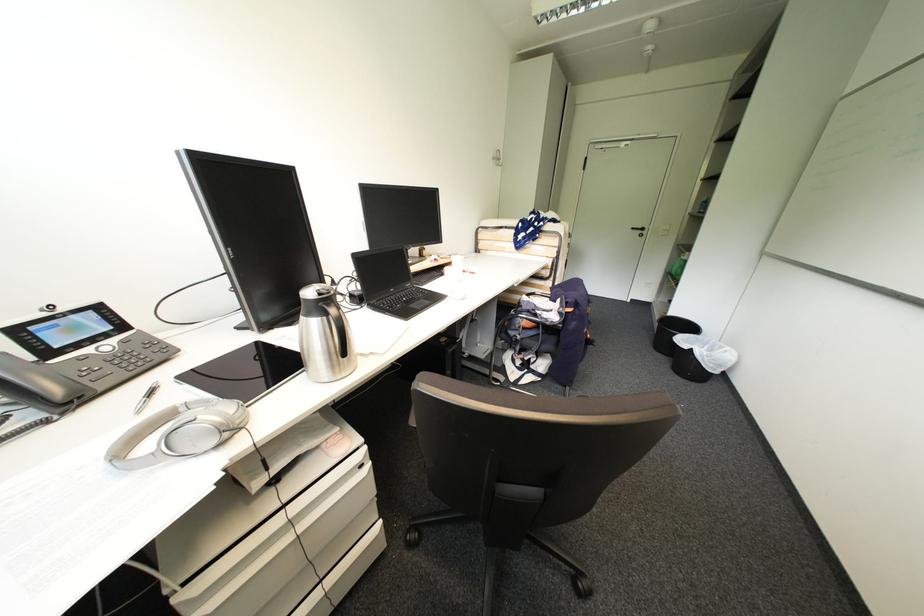
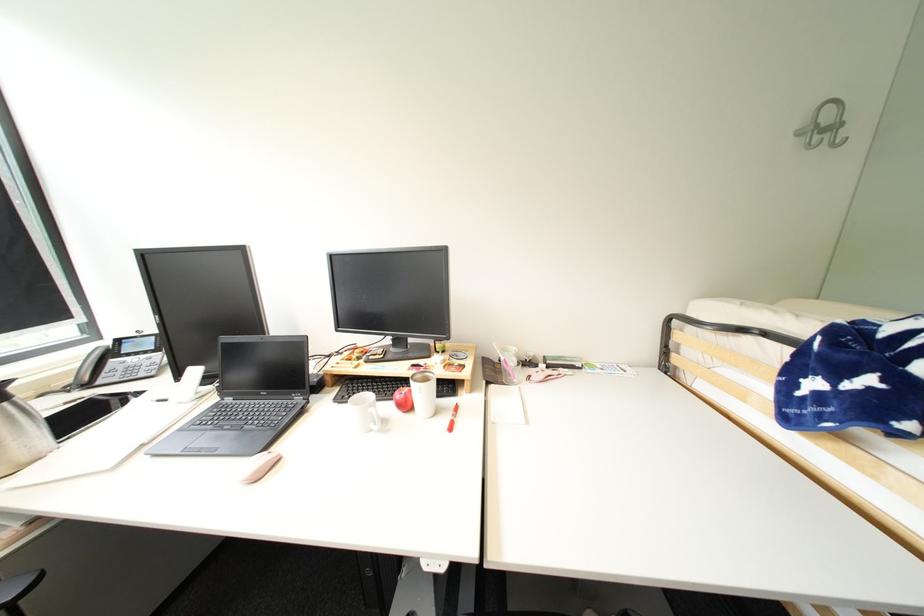
Find the pixel in the second image that matches point 505,160 in the first image.

(841, 128)